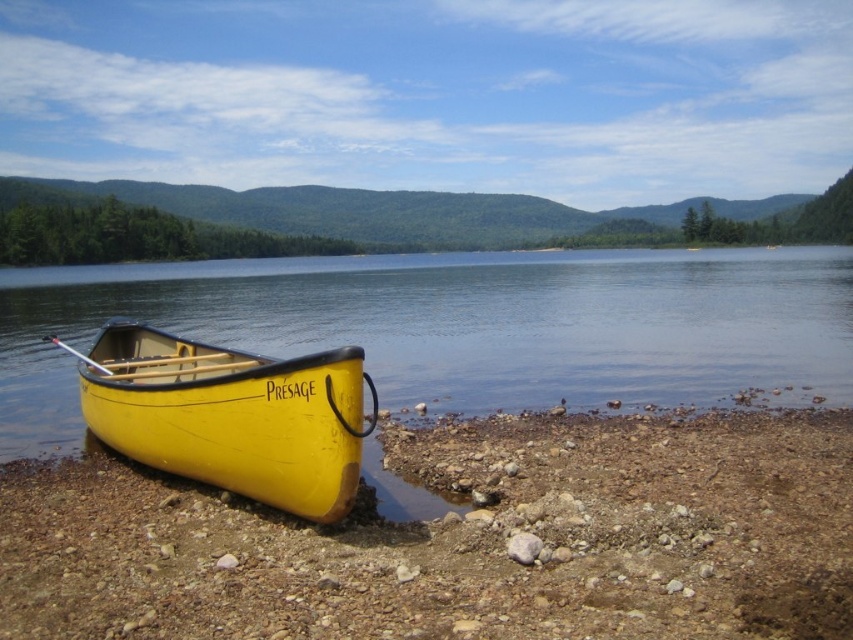
You are a photographer planning to capture the yellow wood water at lower left in the image. Based on its coordinates, where should you position your camera to ensure it is centered in the frame?

To center the yellow wood water at lower left in your frame, position your camera so that it aligns with the coordinates point (457, 324).

You are a photographer planning to capture the yellow wood canoe at lower left in your shot. Given that your camera has a field of view covering coordinates from 0.0 to 1.0 on both axes, can you confirm if the canoe is fully within the camera frame?

The yellow wood canoe at lower left is positioned at point (461, 540), which falls within the camera frame covering coordinates from 0.0 to 1.0 on both axes. Therefore, the canoe is fully within the frame.